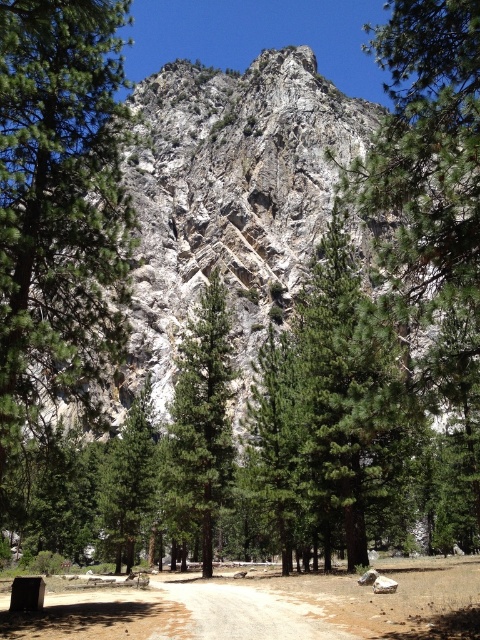
You are hiking along the brown dirt track at center and want to take a photo of the green textured tree at center. In which direction should you move relative to the track to get the tree in your camera view?

To capture the green textured tree at center in your photo while standing on the brown dirt track at center, you should move to the left since the tree is positioned to the left of the track.